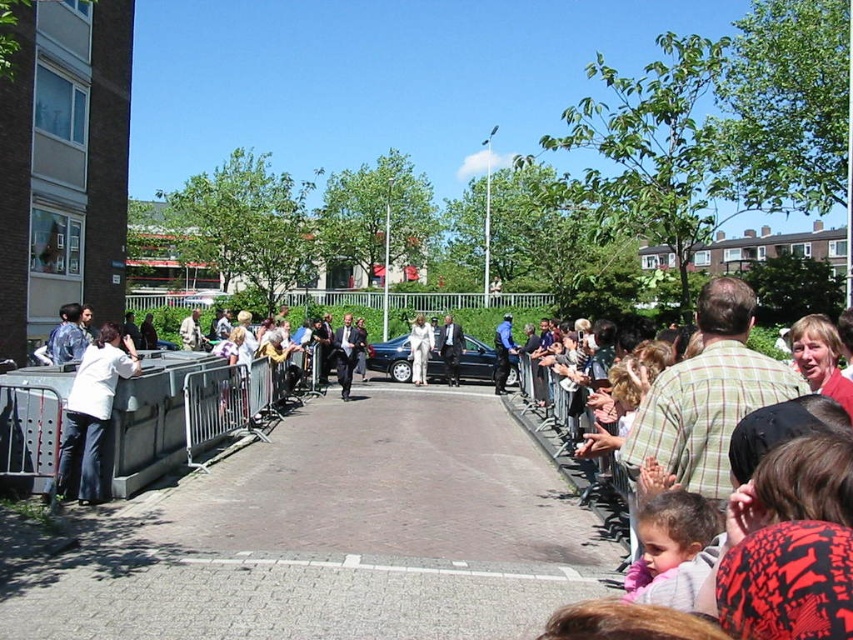
Can you confirm if white fabric jacket at left is positioned to the left of dark suit at center?

Indeed, white fabric jacket at left is positioned on the left side of dark suit at center.

Which is behind, point (107, 403) or point (442, 344)?

Positioned behind is point (442, 344).

Where is `white fabric jacket at left`? This screenshot has width=853, height=640. white fabric jacket at left is located at coordinates (91, 410).

How distant is gray concrete pavement at center from dark suit at center?

They are 11.30 meters apart.

Who is lower down, gray concrete pavement at center or dark suit at center?

gray concrete pavement at center is below.

Does point (259, 625) lie in front of point (445, 372)?

Yes, point (259, 625) is in front of point (445, 372).

Find the location of a particular element. This screenshot has width=853, height=640. gray concrete pavement at center is located at coordinates (337, 536).

What do you see at coordinates (450, 348) in the screenshot?
I see `dark suit at center` at bounding box center [450, 348].

Measure the distance between dark suit at center and camera.

They are 21.02 meters apart.

This screenshot has height=640, width=853. Find the location of `dark suit at center`. dark suit at center is located at coordinates (450, 348).